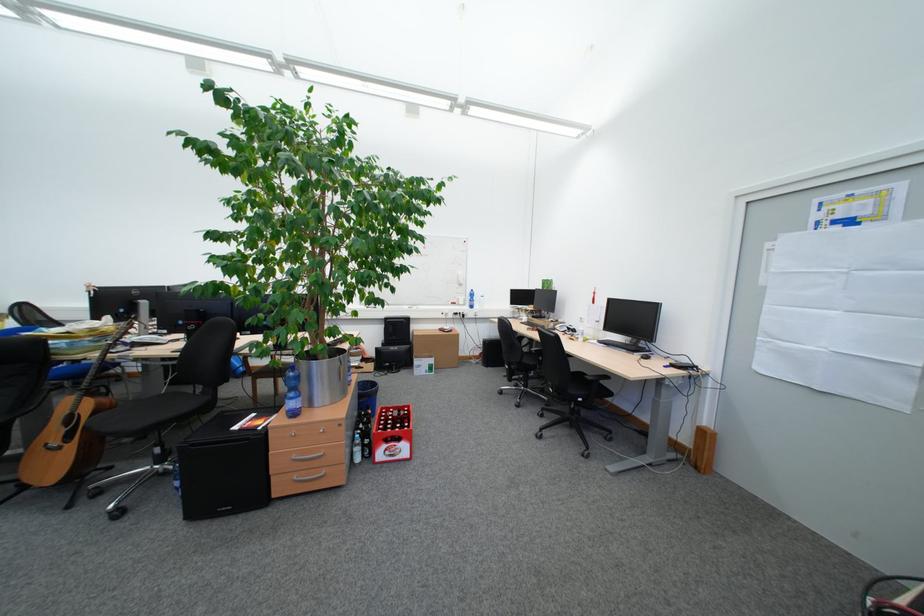
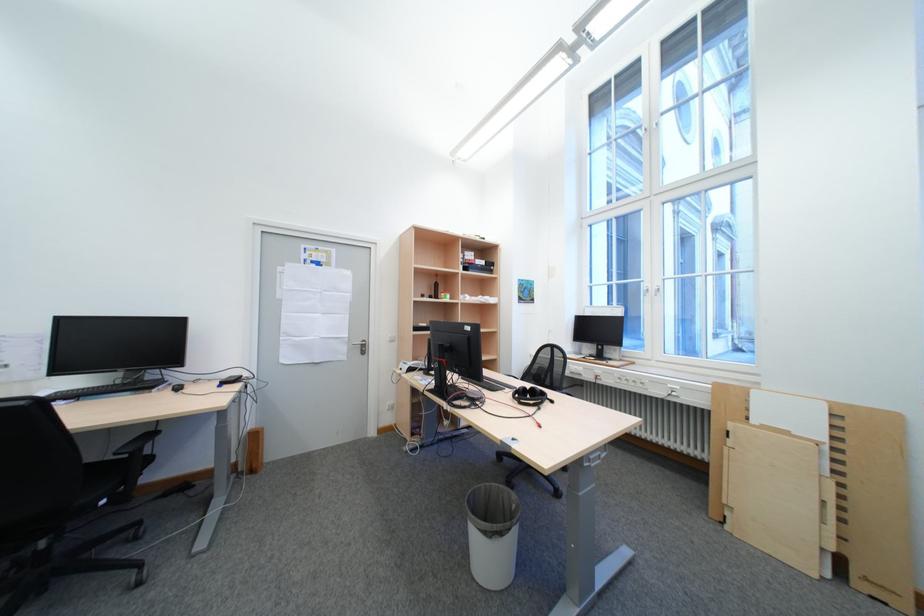
The point at (x=591, y=400) is marked in the first image. Where is the corresponding point in the second image?

(116, 503)